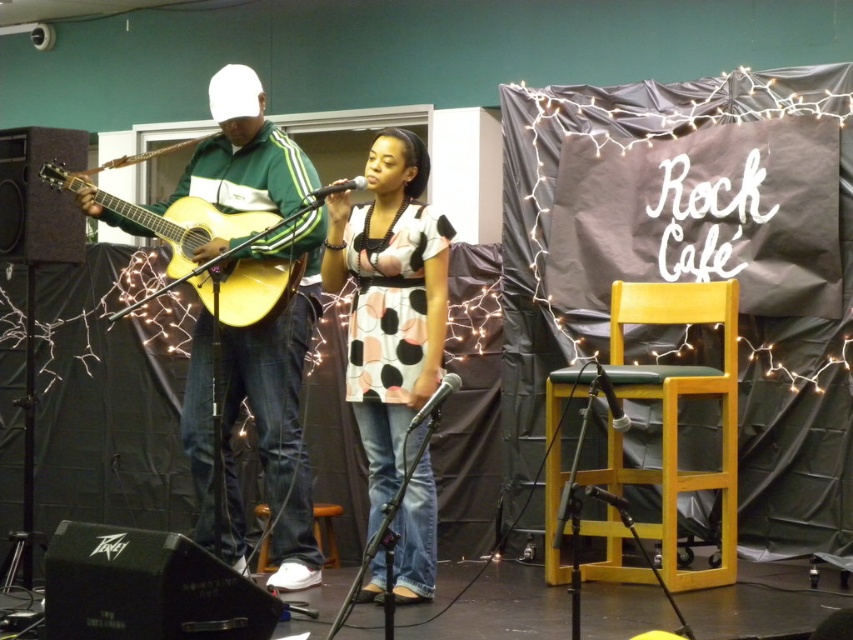
Question: Which object appears closest to the camera in this image?

Choices:
 (A) matte green jacket at center
 (B) acoustic wood guitar at left

Answer: (B)

Question: Is polka dot fabric dress at center thinner than acoustic wood guitar at left?

Choices:
 (A) no
 (B) yes

Answer: (B)

Question: Considering the relative positions of polka dot fabric dress at center and acoustic wood guitar at left in the image provided, where is polka dot fabric dress at center located with respect to acoustic wood guitar at left?

Choices:
 (A) above
 (B) below

Answer: (B)

Question: Which of the following is the closest to the observer?

Choices:
 (A) (134, 307)
 (B) (389, 344)

Answer: (B)

Question: Can you confirm if matte green jacket at center is wider than acoustic wood guitar at left?

Choices:
 (A) yes
 (B) no

Answer: (B)

Question: Which of the following is the farthest from the observer?

Choices:
 (A) (431, 378)
 (B) (305, 305)

Answer: (B)